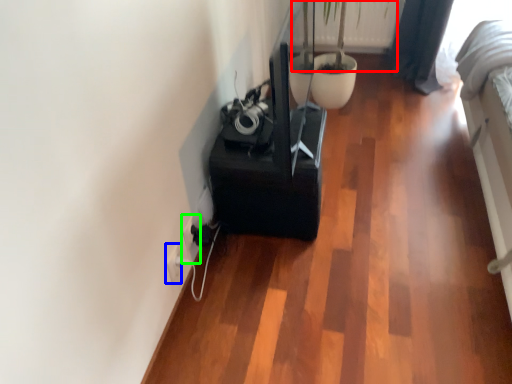
Question: Estimate the real-world distances between objects in this image. Which object is closer to plant (highlighted by a red box), electric outlet (highlighted by a blue box) or electric outlet (highlighted by a green box)?

Choices:
 (A) electric outlet
 (B) electric outlet

Answer: (B)